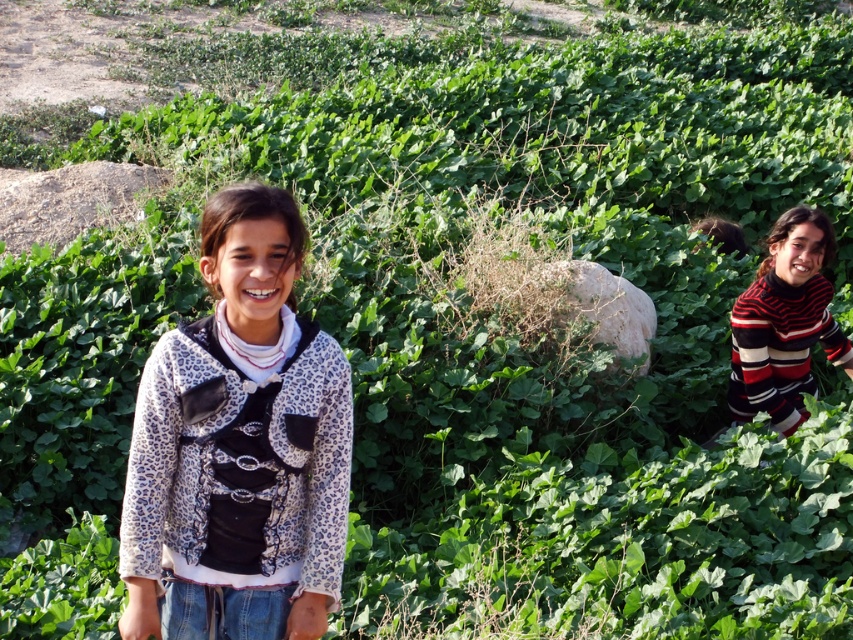
Looking at this image, is leopard print fabric sweater at center positioned behind striped sweater at right?

No, it is in front of striped sweater at right.

Image resolution: width=853 pixels, height=640 pixels. What do you see at coordinates (241, 461) in the screenshot?
I see `leopard print fabric sweater at center` at bounding box center [241, 461].

What do you see at coordinates (241, 461) in the screenshot?
I see `leopard print fabric sweater at center` at bounding box center [241, 461].

Locate an element on the screen. The image size is (853, 640). leopard print fabric sweater at center is located at coordinates (x=241, y=461).